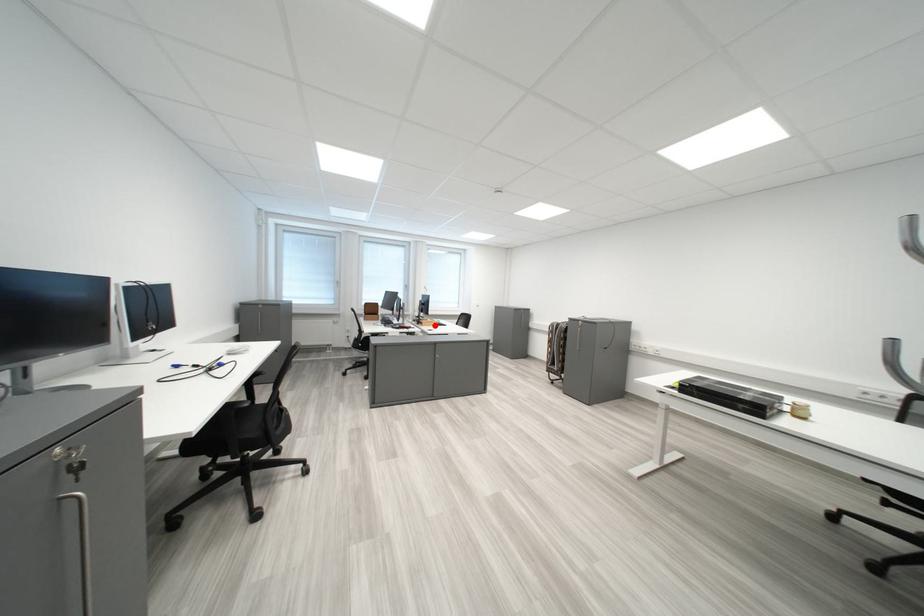
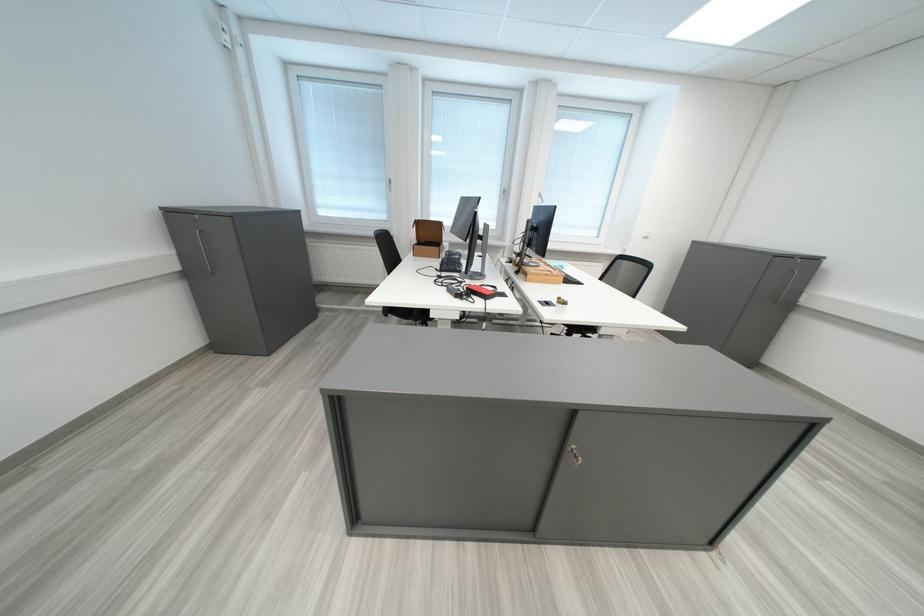
Question: I am providing you with two images of the same scene from different viewpoints. A red point is marked on the first image. At the location where the point appears in image 1, is it still visible in image 2?

Choices:
 (A) Yes
 (B) No

Answer: (A)